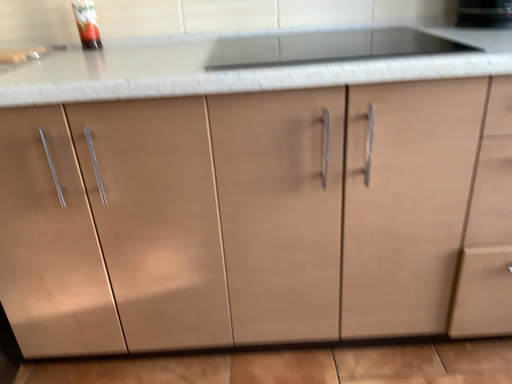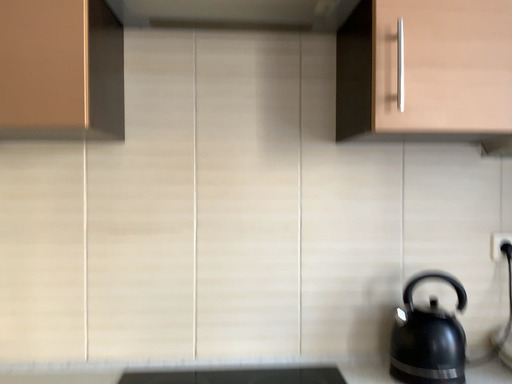
Question: How did the camera likely rotate when shooting the video?

Choices:
 (A) rotated upward
 (B) rotated downward

Answer: (A)